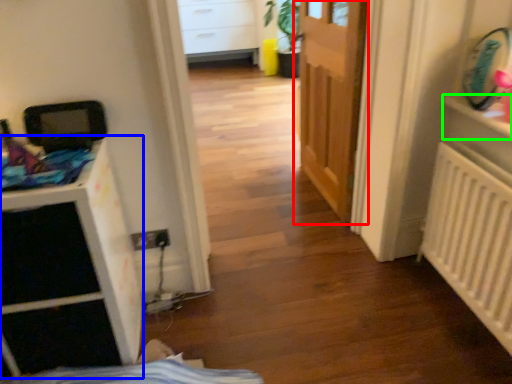
Question: Estimate the real-world distances between objects in this image. Which object is closer to door (highlighted by a red box), file cabinet (highlighted by a blue box) or shelf (highlighted by a green box)?

Choices:
 (A) file cabinet
 (B) shelf

Answer: (B)